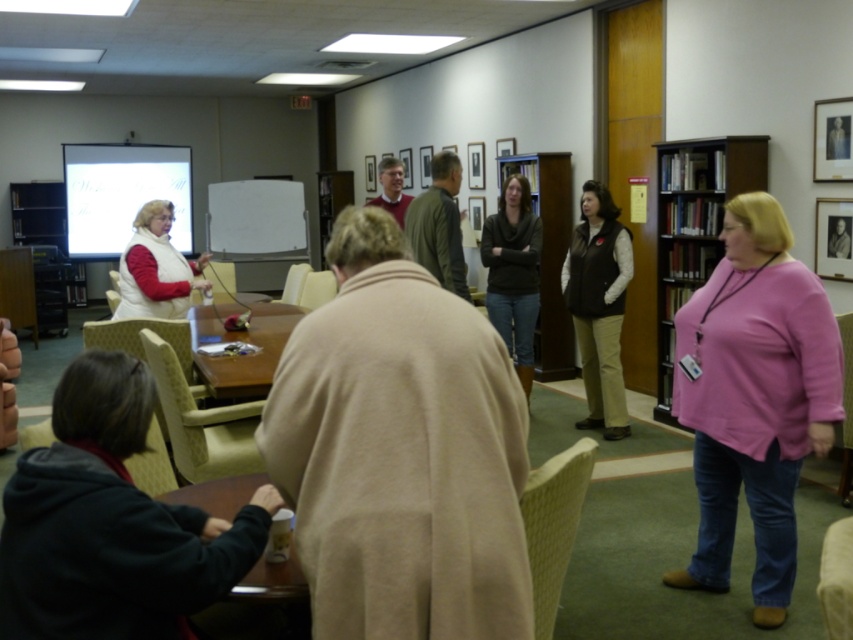
Does light beige fabric chair at center have a greater width compared to light yellow textured chair at center?

Correct, the width of light beige fabric chair at center exceeds that of light yellow textured chair at center.

Find the location of a particular element. This screenshot has width=853, height=640. light beige fabric chair at center is located at coordinates (200, 420).

Who is more distant from viewer, (x=190, y=468) or (x=521, y=509)?

Point (x=190, y=468)

This screenshot has height=640, width=853. I want to click on light beige fabric chair at center, so click(200, 420).

Is white matte projection screen at upper left thinner than pink fabric chair at lower right?

In fact, white matte projection screen at upper left might be wider than pink fabric chair at lower right.

Can you confirm if white matte projection screen at upper left is positioned below pink fabric chair at lower right?

No, white matte projection screen at upper left is not below pink fabric chair at lower right.

Image resolution: width=853 pixels, height=640 pixels. What do you see at coordinates (122, 193) in the screenshot?
I see `white matte projection screen at upper left` at bounding box center [122, 193].

Where is `white matte projection screen at upper left`? The width and height of the screenshot is (853, 640). white matte projection screen at upper left is located at coordinates (122, 193).

Which of these two, dark wood bookshelf at right or light brown fabric chair at center, stands taller?

With more height is dark wood bookshelf at right.

Is point (711, 253) closer to camera compared to point (288, 298)?

Yes, point (711, 253) is in front of point (288, 298).

The image size is (853, 640). What are the coordinates of `dark wood bookshelf at right` in the screenshot? It's located at (694, 227).

The height and width of the screenshot is (640, 853). I want to click on dark wood bookshelf at right, so click(x=694, y=227).